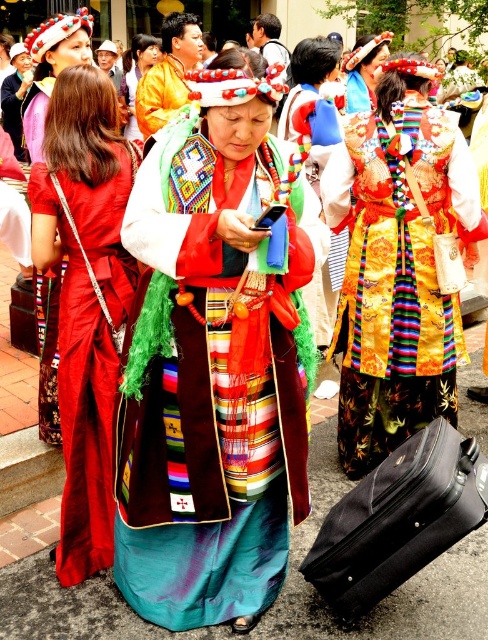
Looking at this image, you are organizing a cultural parade and need to arrange two dresses in the center of the stage. The silky brocade dress at center and the silky red dress at center. Which dress should you place first if you want the larger one to be in the middle?

The silky brocade dress at center is larger than the silky red dress at center, so you should place the silky brocade dress at center first to ensure it is in the middle.

You are a photographer at this cultural event. You want to take a photo that includes both the shiny gold dress at center and the black fabric suitcase at lower right. Which object will appear larger in the photo?

The shiny gold dress at center will appear larger in the photo because it is closer to the viewer than the black fabric suitcase at lower right.

You are a photographer standing 2 meters away from the shiny gold dress at center. You want to take a photo of the dress using a camera that requires you to be within 5 meters of the subject. Can you take the photo without moving closer?

The shiny gold dress at center and camera are 3.15 meters apart. Since the camera must be within 5 meters of the subject, you can take the photo without moving closer because 3.15 meters is within the 5 meter range.